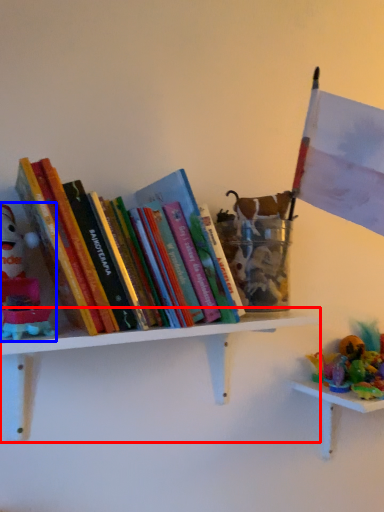
Question: Which point is closer to the camera, shelf (highlighted by a red box) or toy (highlighted by a blue box)?

Choices:
 (A) shelf
 (B) toy

Answer: (B)